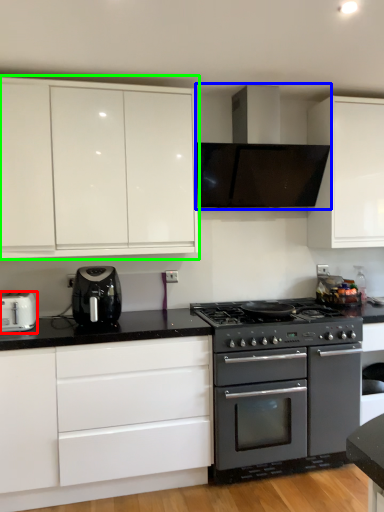
Question: Considering the real-world distances, which object is closest to toaster (highlighted by a red box)? home appliance (highlighted by a blue box) or cabinetry (highlighted by a green box).

Choices:
 (A) home appliance
 (B) cabinetry

Answer: (B)